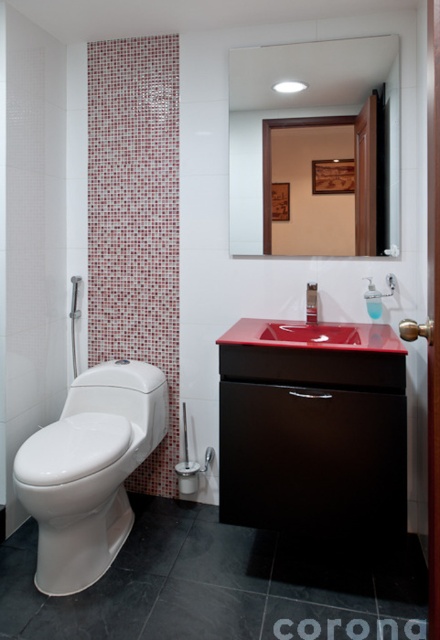
Question: Is matte red sink at center bigger than matte black faucet at sink right?

Choices:
 (A) no
 (B) yes

Answer: (B)

Question: Which of the following is the farthest from the observer?

Choices:
 (A) (260, 465)
 (B) (286, 330)

Answer: (B)

Question: Is the position of matte black faucet at sink right less distant than that of matte white shower at upper center?

Choices:
 (A) yes
 (B) no

Answer: (B)

Question: Estimate the real-world distances between objects in this image. Which object is farther from the matte white shower at upper center?

Choices:
 (A) clear glass mirror at upper center
 (B) dark gray tile at lower center
 (C) matte red sink at center
 (D) white glossy toilet at left

Answer: (B)

Question: Based on their relative distances, which object is nearer to the matte white shower at upper center?

Choices:
 (A) dark gray tile at lower center
 (B) black tile at lower center
 (C) red glossy sink at center

Answer: (C)

Question: Observing the image, what is the correct spatial positioning of dark gray tile at lower center in reference to matte red sink at center?

Choices:
 (A) above
 (B) below

Answer: (B)